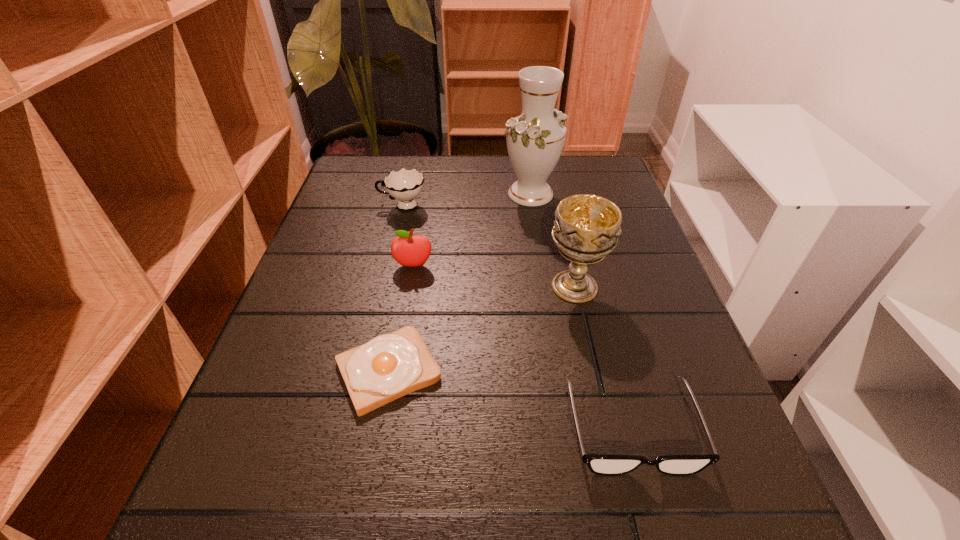
The height and width of the screenshot is (540, 960). Find the location of `vase`. vase is located at coordinates (535, 139).

This screenshot has height=540, width=960. I want to click on the second tallest object, so click(586, 228).

Locate an element on the screen. The height and width of the screenshot is (540, 960). the third tallest object is located at coordinates (410, 251).

You are a GUI agent. You are given a task and a screenshot of the screen. Output one action in this format:
    pyautogui.click(x=<x>, y=<y>)
    Task: Click on the cup
    The width and height of the screenshot is (960, 540).
    Given the screenshot: What is the action you would take?
    pyautogui.click(x=405, y=185)

Image resolution: width=960 pixels, height=540 pixels. I want to click on spectacles, so click(607, 465).

The width and height of the screenshot is (960, 540). Identify the location of toast. (390, 366).

This screenshot has width=960, height=540. Find the location of `free space located on the front of the vase`. free space located on the front of the vase is located at coordinates (537, 234).

At what (x,y) coordinates should I click in order to perform the action: click on free space located on the front of the second tallest object. Please return your answer as a coordinate pair (x, y). The width and height of the screenshot is (960, 540). Looking at the image, I should click on (606, 424).

At what (x,y) coordinates should I click in order to perform the action: click on vacant area situated 0.170m on the front of the third tallest object. Please return your answer as a coordinate pair (x, y). The width and height of the screenshot is (960, 540). Looking at the image, I should click on (401, 338).

Identify the location of vacant area located on the side of the cup with the handle. (332, 206).